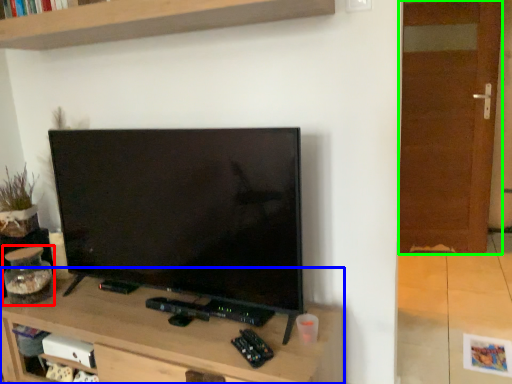
Question: Based on their relative distances, which object is farther from glass jar (highlighted by a red box)? Choose from table (highlighted by a blue box) and glass door (highlighted by a green box).

Choices:
 (A) table
 (B) glass door

Answer: (B)